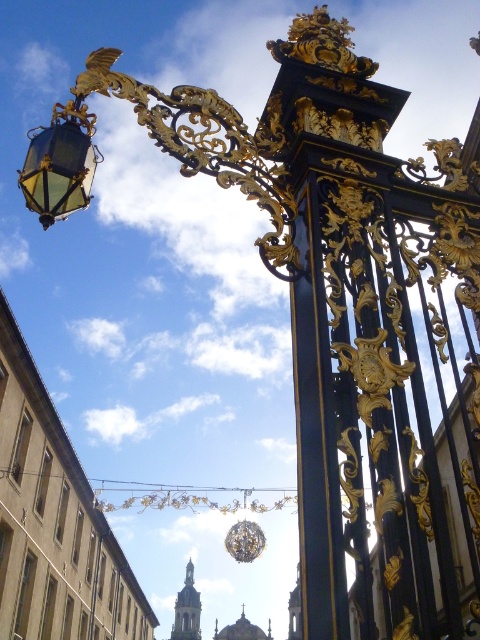
You are standing at the entrance of the gate and want to determine which of the two points, point [325,560] or point [37,209], is nearer to you. Based on the scene description, which point is closer?

Point [325,560] is closer to the viewer than point [37,209].